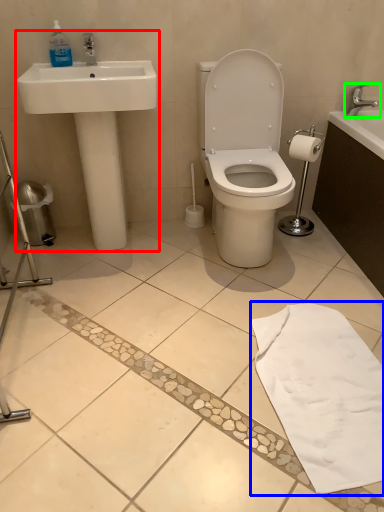
Question: Estimate the real-world distances between objects in this image. Which object is farther from sink (highlighted by a red box), bath towel (highlighted by a blue box) or tap (highlighted by a green box)?

Choices:
 (A) bath towel
 (B) tap

Answer: (B)